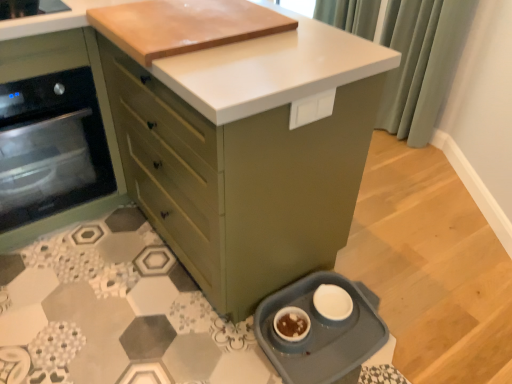
Question: Can you confirm if white matte bowl at lower center is positioned to the left of green fabric curtain at upper right?

Choices:
 (A) yes
 (B) no

Answer: (A)

Question: Does white matte bowl at lower center have a lesser width compared to green fabric curtain at upper right?

Choices:
 (A) yes
 (B) no

Answer: (A)

Question: Is white matte bowl at lower center positioned beyond the bounds of green fabric curtain at upper right?

Choices:
 (A) yes
 (B) no

Answer: (A)

Question: Does white matte bowl at lower center lie behind green fabric curtain at upper right?

Choices:
 (A) no
 (B) yes

Answer: (A)

Question: From a real-world perspective, is white matte bowl at lower center physically below green fabric curtain at upper right?

Choices:
 (A) yes
 (B) no

Answer: (A)

Question: Is green fabric curtain at upper right at the back of white matte bowl at lower center?

Choices:
 (A) yes
 (B) no

Answer: (B)

Question: Considering the relative sizes of blue plastic pet dish at lower right and white matte bowl at lower center in the image provided, is blue plastic pet dish at lower right bigger than white matte bowl at lower center?

Choices:
 (A) yes
 (B) no

Answer: (A)

Question: Can white matte bowl at lower center be found inside blue plastic pet dish at lower right?

Choices:
 (A) no
 (B) yes

Answer: (B)

Question: Is blue plastic pet dish at lower right outside of white matte bowl at lower center?

Choices:
 (A) yes
 (B) no

Answer: (A)

Question: Can you see blue plastic pet dish at lower right touching white matte bowl at lower center?

Choices:
 (A) no
 (B) yes

Answer: (A)

Question: From a real-world perspective, is blue plastic pet dish at lower right physically below white matte bowl at lower center?

Choices:
 (A) yes
 (B) no

Answer: (A)

Question: Does blue plastic pet dish at lower right come behind white matte bowl at lower center?

Choices:
 (A) no
 (B) yes

Answer: (A)

Question: Is green fabric curtain at upper right to the right of matte green oven at left, the second cabinetry viewed from the right, from the viewer's perspective?

Choices:
 (A) yes
 (B) no

Answer: (A)